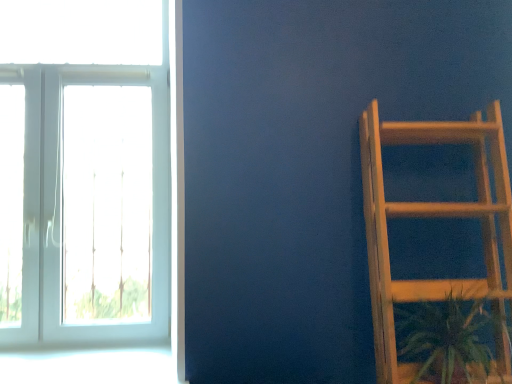
Question: Is wooden ladder at right not near white glass window at left?

Choices:
 (A) yes
 (B) no

Answer: (A)

Question: Is wooden ladder at right oriented away from white glass window at left?

Choices:
 (A) yes
 (B) no

Answer: (B)

Question: Can you confirm if wooden ladder at right is thinner than white glass window at left?

Choices:
 (A) no
 (B) yes

Answer: (A)

Question: Does wooden ladder at right come in front of white glass window at left?

Choices:
 (A) no
 (B) yes

Answer: (B)

Question: From the image's perspective, is wooden ladder at right over white glass window at left?

Choices:
 (A) no
 (B) yes

Answer: (A)

Question: Considering the positions of white glass window at left and wooden ladder at right in the image, is white glass window at left taller or shorter than wooden ladder at right?

Choices:
 (A) tall
 (B) short

Answer: (A)

Question: Considering their positions, is white glass window at left located in front of or behind wooden ladder at right?

Choices:
 (A) behind
 (B) front

Answer: (A)

Question: Choose the correct answer: Is white glass window at left inside wooden ladder at right or outside it?

Choices:
 (A) outside
 (B) inside

Answer: (A)

Question: From the image's perspective, is white glass window at left located above or below wooden ladder at right?

Choices:
 (A) below
 (B) above

Answer: (B)

Question: Looking at their shapes, would you say green leafy plant at lower right is wider or thinner than wooden ladder at right?

Choices:
 (A) thin
 (B) wide

Answer: (A)

Question: From a real-world perspective, is green leafy plant at lower right positioned above or below wooden ladder at right?

Choices:
 (A) below
 (B) above

Answer: (A)

Question: Is green leafy plant at lower right bigger or smaller than wooden ladder at right?

Choices:
 (A) small
 (B) big

Answer: (A)

Question: In terms of height, does green leafy plant at lower right look taller or shorter compared to wooden ladder at right?

Choices:
 (A) tall
 (B) short

Answer: (B)

Question: Is point (387, 142) closer or farther from the camera than point (468, 342)?

Choices:
 (A) farther
 (B) closer

Answer: (A)

Question: Is wooden ladder at right to the left or to the right of green leafy plant at lower right in the image?

Choices:
 (A) right
 (B) left

Answer: (B)